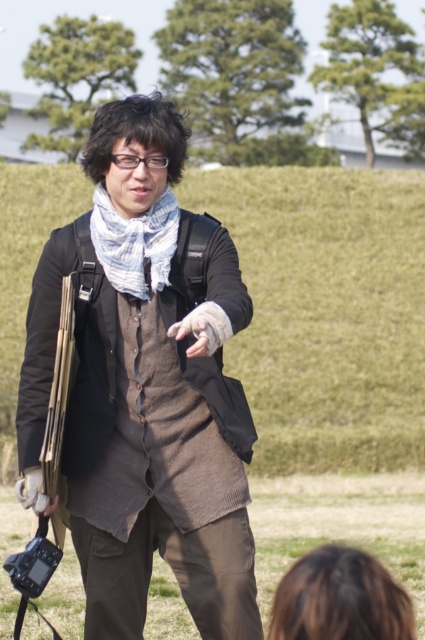
From the picture: You are a photographer trying to capture a closeup of the white textured scarf at center and the leather glove at center. Which object should you focus on first to ensure it appears sharp in the photo?

You should focus on the white textured scarf at center first because it is closer to the viewer than the leather glove at center, ensuring it will be in focus before adjusting for the other object.

You are a fashion designer analyzing the outfit of the person in the image. The person is wearing a knitted brown vest at center and a white textured scarf at center. Which clothing item is wider?

The knitted brown vest at center is wider than the white textured scarf at center.